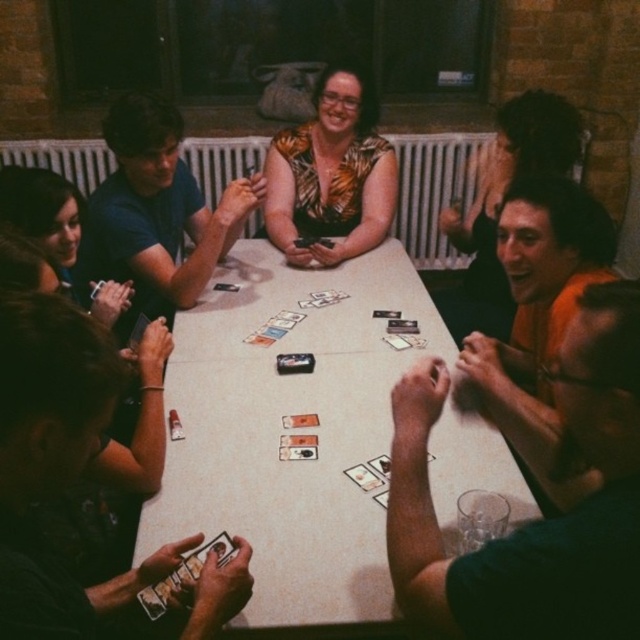
You are a photographer taking a picture of the card game scene. You notice two points on the table marked as point (333,429) and point (369,198). Which point should you focus on if you want to ensure the closest object to the camera is in sharp focus?

Point (333,429) is closer to the camera than point (369,198), so you should focus on point (333,429) to ensure the closest object is in sharp focus.

You are sitting at the edge of the room and want to reach the white glossy table at center to grab a card. However, there is a printed fabric blouse at center in your way. Can you walk straight to the table without stepping over the blouse?

The white glossy table at center is in front of the printed fabric blouse at center, meaning the table is closer to you. Therefore, you can walk straight to the white glossy table at center without stepping over the printed fabric blouse at center.

You are a game organizer who needs to place a new card deck on the table. According to the image, where should you place the deck to ensure it is centered on the white glossy table at center?

The white glossy table at center is located at point (292, 435), so you should place the new card deck at that coordinate to center it.